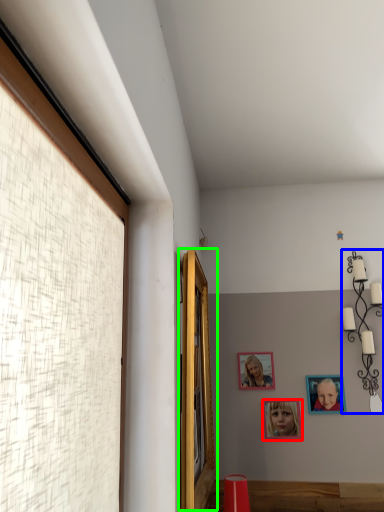
Question: Based on their relative distances, which object is farther from picture frame (highlighted by a red box)? Choose from lamp (highlighted by a blue box) and window (highlighted by a green box).

Choices:
 (A) lamp
 (B) window

Answer: (B)